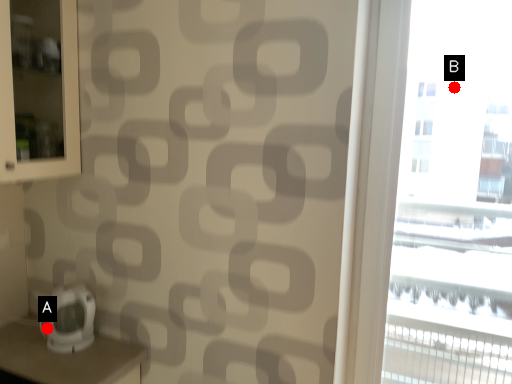
Question: Two points are circled on the image, labeled by A and B beside each circle. Which point is closer to the camera taking this photo?

Choices:
 (A) A is closer
 (B) B is closer

Answer: (B)